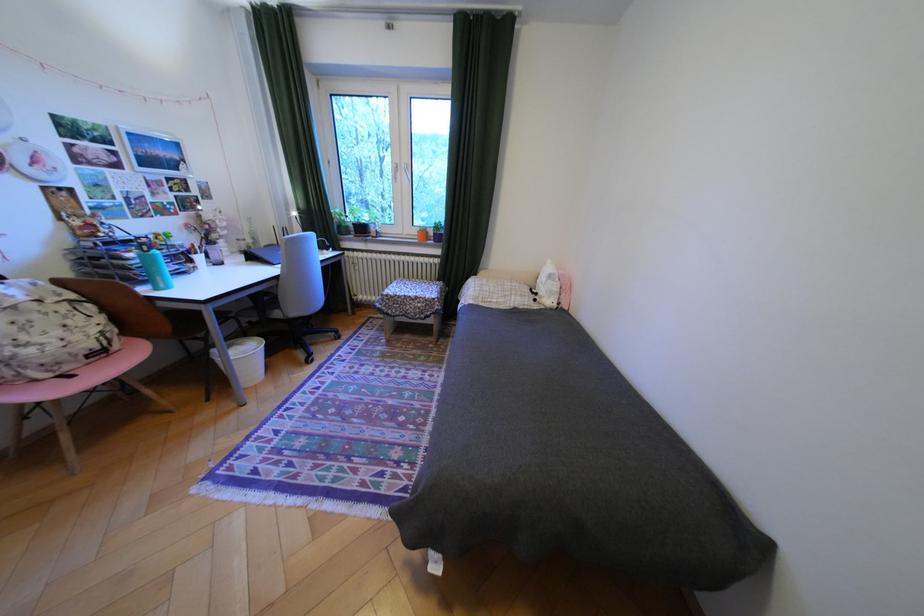
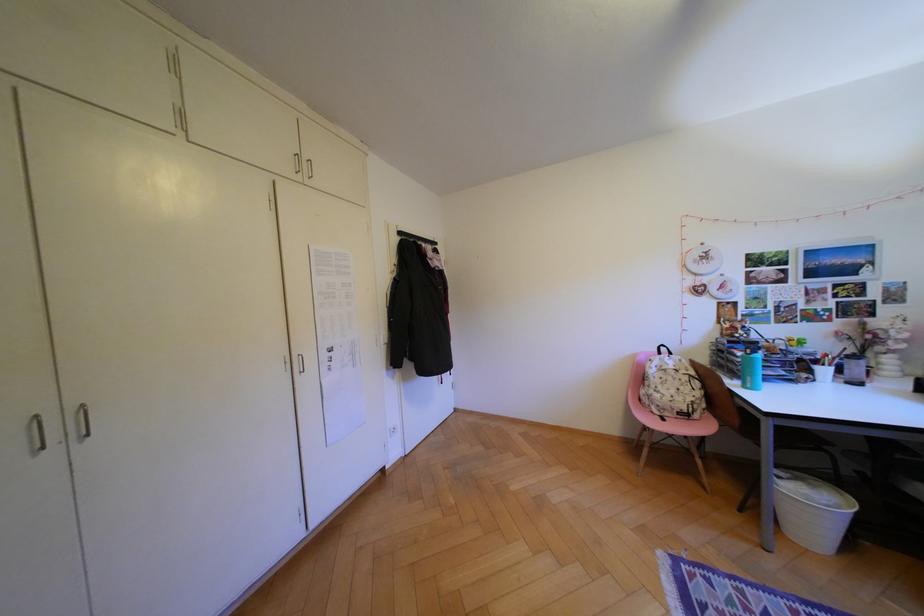
Question: The camera is either moving clockwise (left) or counter-clockwise (right) around the object. The first image is from the beginning of the video and the second image is from the end. Is the camera moving left or right when shooting the video?

Choices:
 (A) Left
 (B) Right

Answer: (B)